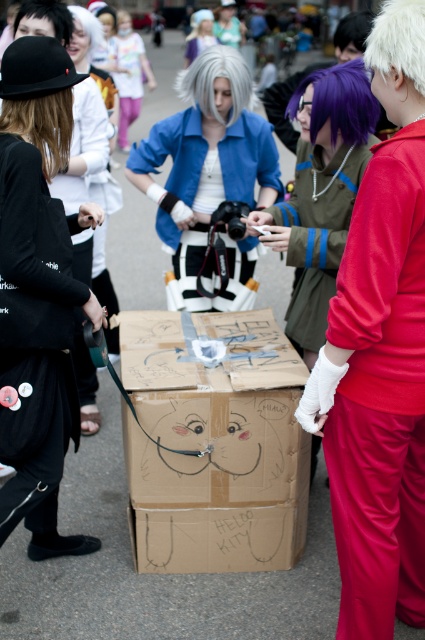
Which of these two, shiny black wig at left or purple hair at center, stands taller?

With more height is purple hair at center.

Find the location of a particular element. This screenshot has height=640, width=425. shiny black wig at left is located at coordinates (42, 125).

Can you confirm if matte green jacket at center is positioned to the left of black matte wig at upper left?

In fact, matte green jacket at center is to the right of black matte wig at upper left.

Where is `matte green jacket at center`? matte green jacket at center is located at coordinates (320, 193).

Find the location of a particular element. This screenshot has width=425, height=640. matte green jacket at center is located at coordinates (320, 193).

The height and width of the screenshot is (640, 425). Describe the element at coordinates (320, 193) in the screenshot. I see `matte green jacket at center` at that location.

Does matte green jacket at center lie behind white matte wig at center?

No, it is not.

Is point (283, 225) closer to viewer compared to point (246, 96)?

Yes, point (283, 225) is in front of point (246, 96).

This screenshot has height=640, width=425. I want to click on matte green jacket at center, so click(x=320, y=193).